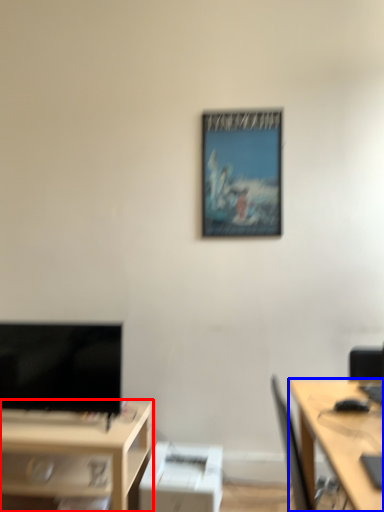
Question: Which of the following is the farthest to the observer, desk (highlighted by a red box) or desk (highlighted by a blue box)?

Choices:
 (A) desk
 (B) desk

Answer: (A)